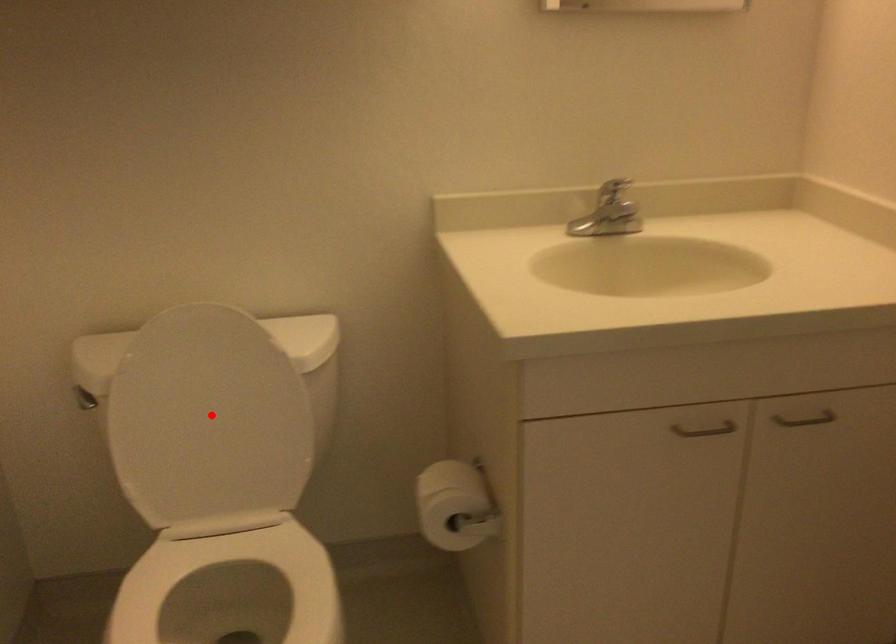
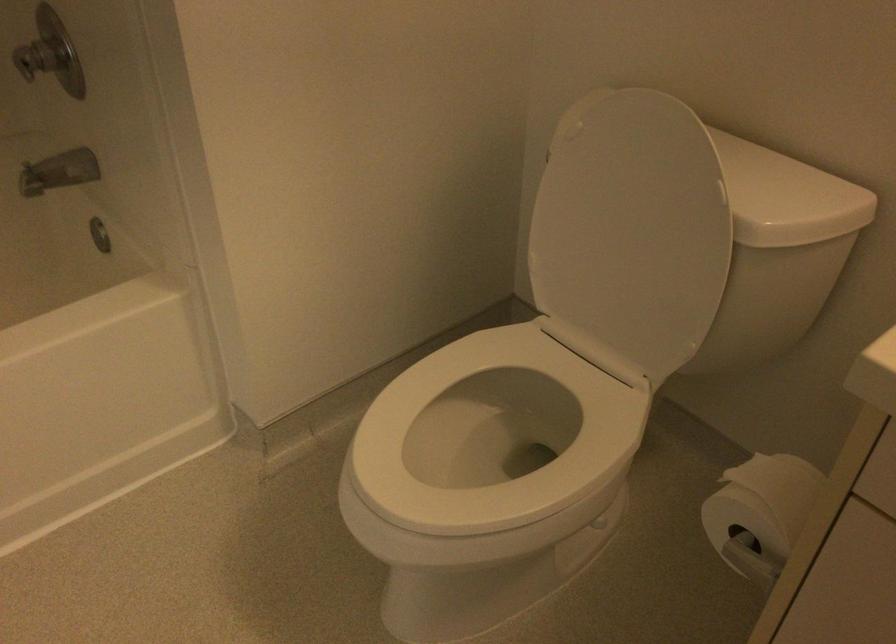
Question: I am providing you with two images of the same scene from different viewpoints. A red point is marked on the first image. Is the red point's position out of view in image 2?

Choices:
 (A) Yes
 (B) No

Answer: (B)